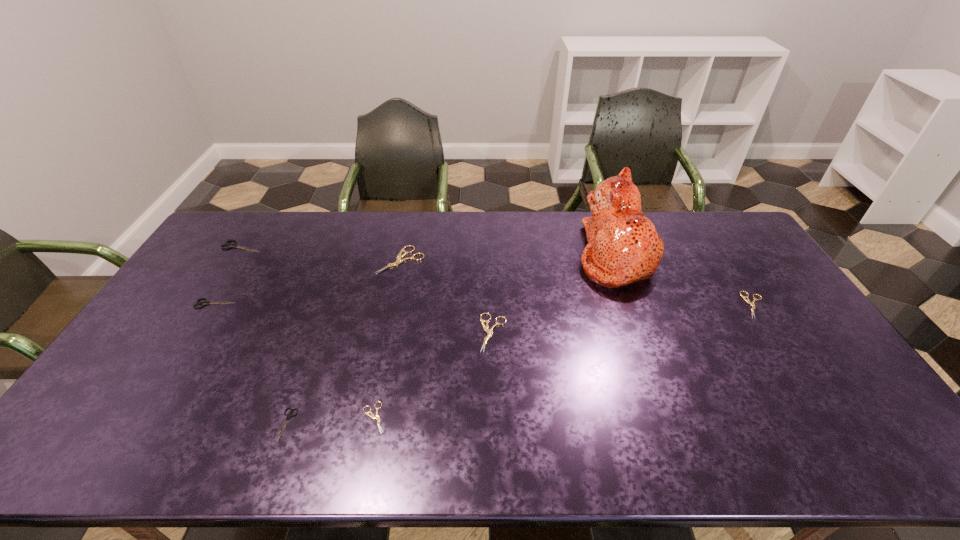
You are a GUI agent. You are given a task and a screenshot of the screen. Output one action in this format:
    pyautogui.click(x=<x>, y=<y>)
    Task: Click on the free spot located on the front of the rightmost shears
    This screenshot has height=540, width=960.
    Given the screenshot: What is the action you would take?
    pyautogui.click(x=838, y=434)

Image resolution: width=960 pixels, height=540 pixels. I want to click on vacant region located on the left of the third object from left to right, so click(x=247, y=425).

Where is `blank area located 0.050m on the back of the nearest beige shears`? blank area located 0.050m on the back of the nearest beige shears is located at coordinates (380, 385).

Find the location of a particular element. cat that is positioned at the far edge is located at coordinates (624, 247).

The height and width of the screenshot is (540, 960). I want to click on object that is at the right edge, so click(747, 300).

Locate an element on the screen. This screenshot has width=960, height=540. object that is positioned at the far left corner is located at coordinates click(x=231, y=245).

Locate an element on the screen. vacant area at the far edge of the desktop is located at coordinates (324, 247).

Where is `vacant area at the near edge`? The width and height of the screenshot is (960, 540). vacant area at the near edge is located at coordinates (164, 442).

I want to click on free space at the left edge of the desktop, so click(164, 312).

This screenshot has height=540, width=960. Identify the location of vacant space at the right edge. (768, 336).